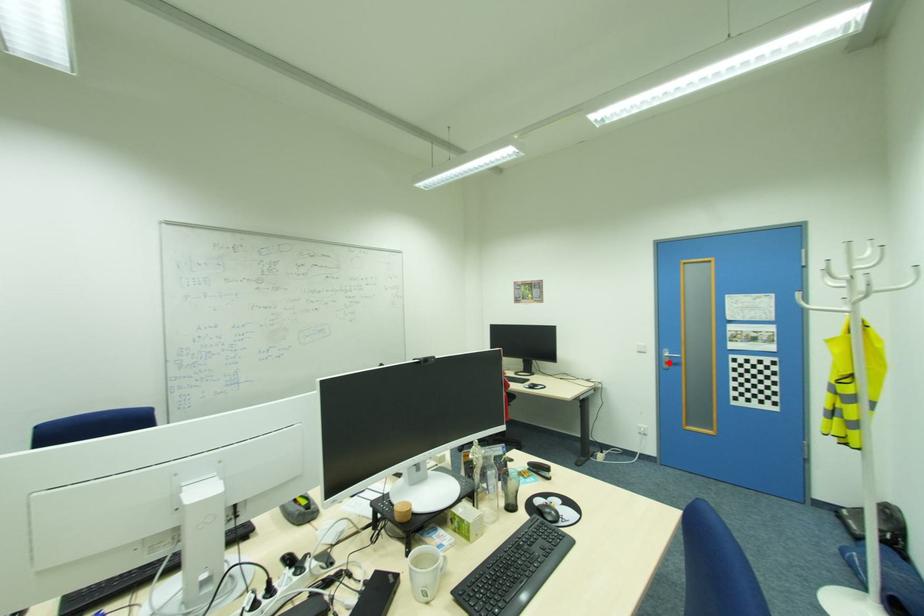
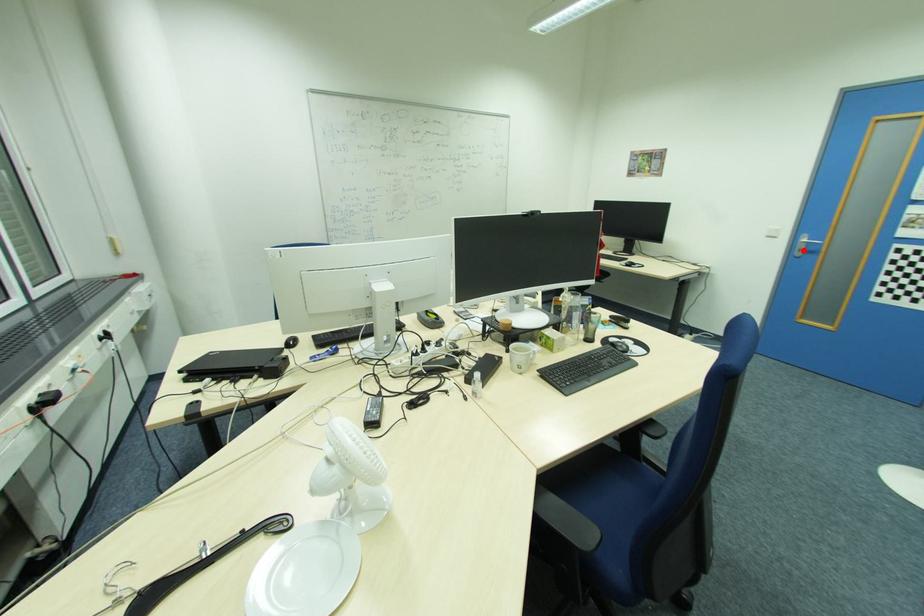
I am providing you with two images of the same scene from different viewpoints. A red point is marked on the first image and another point is marked on the second image. Are the points marked in image1 and image2 representing the same 3D position?

Yes